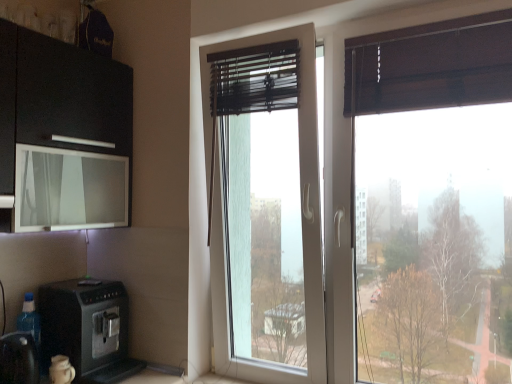
What are the coordinates of `vacant space situated above transparent glass window screen at upper left (from a real-world perspective)` in the screenshot? It's located at (71, 147).